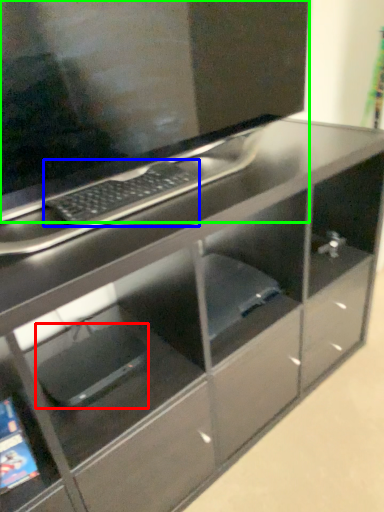
Question: Estimate the real-world distances between objects in this image. Which object is closer to computer (highlighted by a red box), computer keyboard (highlighted by a blue box) or computer monitor (highlighted by a green box)?

Choices:
 (A) computer keyboard
 (B) computer monitor

Answer: (A)